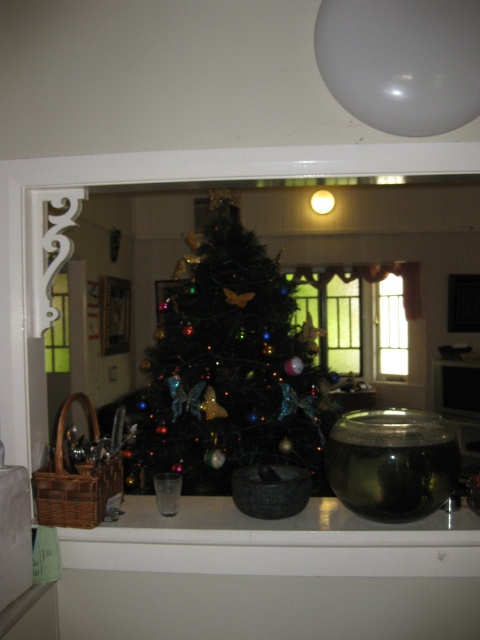
Can you confirm if shiny green christmas tree at center is bigger than translucent glass window at center?

Yes.

The width and height of the screenshot is (480, 640). Describe the element at coordinates (228, 369) in the screenshot. I see `shiny green christmas tree at center` at that location.

Find the location of `shiny green christmas tree at center`. shiny green christmas tree at center is located at coordinates (228, 369).

Where is `shiny green christmas tree at center`? This screenshot has height=640, width=480. shiny green christmas tree at center is located at coordinates (228, 369).